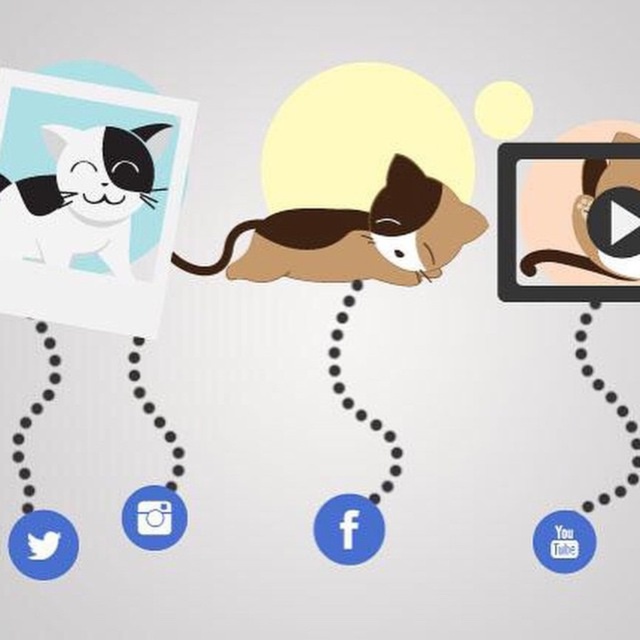
Question: Is brown plush cat at center thinner than matte black cat at upper left?

Choices:
 (A) yes
 (B) no

Answer: (B)

Question: Among these points, which one is nearest to the camera?

Choices:
 (A) (99, 128)
 (B) (460, 204)

Answer: (A)

Question: Which point is farther to the camera?

Choices:
 (A) (477, 211)
 (B) (56, 182)

Answer: (A)

Question: Does brown plush cat at center lie in front of matte black cat at upper left?

Choices:
 (A) no
 (B) yes

Answer: (A)

Question: Is brown plush cat at center wider than matte black cat at upper left?

Choices:
 (A) no
 (B) yes

Answer: (B)